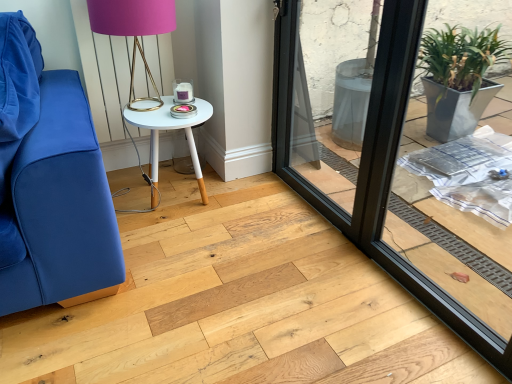
The height and width of the screenshot is (384, 512). What do you see at coordinates (343, 103) in the screenshot? I see `transparent glass screen door at center` at bounding box center [343, 103].

Measure the distance between point (x=389, y=78) and camera.

Point (x=389, y=78) is 4.59 feet from camera.

Image resolution: width=512 pixels, height=384 pixels. What do you see at coordinates (134, 30) in the screenshot?
I see `matte gold table lamp at upper center` at bounding box center [134, 30].

In order to click on white painted wood table at center in this screenshot , I will do [x=170, y=129].

This screenshot has width=512, height=384. Find the location of `window frame that is in front of the matte gold table lamp at upper center`. window frame that is in front of the matte gold table lamp at upper center is located at coordinates (407, 145).

From a real-world perspective, is black glass window frame at center on top of matte gold table lamp at upper center?

No.

Is black glass window frame at center further to the viewer compared to matte gold table lamp at upper center?

No, black glass window frame at center is closer to the viewer.

How far apart are black glass window frame at center and matte gold table lamp at upper center?

black glass window frame at center and matte gold table lamp at upper center are 4.66 feet apart from each other.

Can you confirm if matte gold table lamp at upper center is wider than black glass window frame at center?

Correct, the width of matte gold table lamp at upper center exceeds that of black glass window frame at center.

Identify the location of window frame in front of the matte gold table lamp at upper center. Image resolution: width=512 pixels, height=384 pixels. coord(407,145).

From a real-world perspective, is matte gold table lamp at upper center physically below black glass window frame at center?

Incorrect, from a real-world perspective, matte gold table lamp at upper center is higher than black glass window frame at center.

Is matte gold table lamp at upper center not inside black glass window frame at center?

Yes, matte gold table lamp at upper center is outside of black glass window frame at center.

From a real-world perspective, is transparent glass screen door at center positioned above or below matte gold table lamp at upper center?

Clearly, from a real-world perspective, transparent glass screen door at center is below matte gold table lamp at upper center.

Between transparent glass screen door at center and matte gold table lamp at upper center, which one appears on the right side from the viewer's perspective?

From the viewer's perspective, transparent glass screen door at center appears more on the right side.

Is matte gold table lamp at upper center at the back of transparent glass screen door at center?

transparent glass screen door at center does not have its back to matte gold table lamp at upper center.

Which object is positioned more to the right, white painted wood table at center or black glass window frame at center?

Positioned to the right is black glass window frame at center.

Locate an element on the screen. The image size is (512, 384). table that is under the black glass window frame at center (from a real-world perspective) is located at coordinates (170, 129).

Do you think white painted wood table at center is within black glass window frame at center, or outside of it?

white painted wood table at center is spatially situated outside black glass window frame at center.

From the picture: Does white painted wood table at center turn towards black glass window frame at center?

No, white painted wood table at center is not facing towards black glass window frame at center.

From a real-world perspective, is matte gold table lamp at upper center beneath transparent glass screen door at center?

No, from a real-world perspective, matte gold table lamp at upper center is not under transparent glass screen door at center.

Who is shorter, matte gold table lamp at upper center or transparent glass screen door at center?

Standing shorter between the two is matte gold table lamp at upper center.

Find the location of a particular element. table lamp positioned vertically above the transparent glass screen door at center (from a real-world perspective) is located at coordinates (134, 30).

Does white painted wood table at center turn towards matte gold table lamp at upper center?

No, white painted wood table at center is not facing towards matte gold table lamp at upper center.

Looking at this image, from the image's perspective, which object appears higher, white painted wood table at center or matte gold table lamp at upper center?

matte gold table lamp at upper center, from the image's perspective.

From a real-world perspective, is white painted wood table at center physically located above or below matte gold table lamp at upper center?

white painted wood table at center is situated lower than matte gold table lamp at upper center in the real world.

Considering the positions of point (123, 30) and point (176, 127), is point (123, 30) closer or farther from the camera than point (176, 127)?

Point (123, 30) is positioned closer to the camera compared to point (176, 127).

Is matte gold table lamp at upper center taller or shorter than white painted wood table at center?

Considering their sizes, matte gold table lamp at upper center has more height than white painted wood table at center.

Which object is thinner, matte gold table lamp at upper center or white painted wood table at center?

matte gold table lamp at upper center.

Is the position of matte gold table lamp at upper center less distant than that of white painted wood table at center?

Yes.

The height and width of the screenshot is (384, 512). Identify the location of table lamp that is on the left side of black glass window frame at center. (134, 30).

Identify the location of window frame on the right of matte gold table lamp at upper center. (407, 145).

Which object lies nearer to the anchor point white painted wood table at center, transparent glass screen door at center or matte gold table lamp at upper center?

matte gold table lamp at upper center.

From the image, which object appears to be farther from matte gold table lamp at upper center, black glass window frame at center or transparent glass screen door at center?

The object further to matte gold table lamp at upper center is black glass window frame at center.

Estimate the real-world distances between objects in this image. Which object is further from white painted wood table at center, black glass window frame at center or matte gold table lamp at upper center?

The object further to white painted wood table at center is black glass window frame at center.

When comparing their distances from white painted wood table at center, does matte gold table lamp at upper center or black glass window frame at center seem closer?

matte gold table lamp at upper center.

Which object lies further to the anchor point matte gold table lamp at upper center, transparent glass screen door at center or black glass window frame at center?

The object further to matte gold table lamp at upper center is black glass window frame at center.

Based on their spatial positions, is black glass window frame at center or white painted wood table at center closer to transparent glass screen door at center?

black glass window frame at center is positioned closer to the anchor transparent glass screen door at center.

Considering their positions, is matte gold table lamp at upper center positioned closer to black glass window frame at center than white painted wood table at center?

Based on the image, white painted wood table at center appears to be nearer to black glass window frame at center.

Which object lies nearer to the anchor point black glass window frame at center, white painted wood table at center or matte gold table lamp at upper center?

Based on the image, white painted wood table at center appears to be nearer to black glass window frame at center.

Where is `screen door between matte gold table lamp at upper center and black glass window frame at center in the horizontal direction`? screen door between matte gold table lamp at upper center and black glass window frame at center in the horizontal direction is located at coordinates (343, 103).

This screenshot has height=384, width=512. Identify the location of table lamp between black glass window frame at center and white painted wood table at center in the front-back direction. (134, 30).

I want to click on screen door positioned between black glass window frame at center and white painted wood table at center from near to far, so click(343, 103).

You are a GUI agent. You are given a task and a screenshot of the screen. Output one action in this format:
    pyautogui.click(x=<x>, y=<y>)
    Task: Click on the table between matte gold table lamp at upper center and transparent glass screen door at center
    Image resolution: width=512 pixels, height=384 pixels.
    Given the screenshot: What is the action you would take?
    pyautogui.click(x=170, y=129)